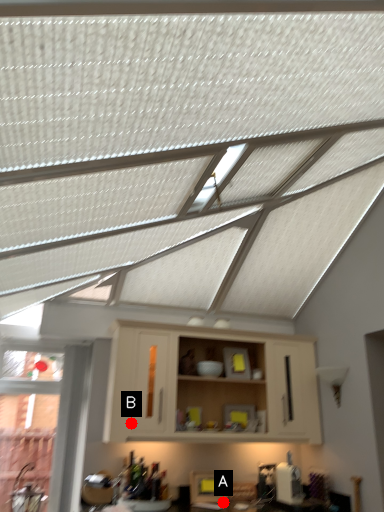
Question: Two points are circled on the image, labeled by A and B beside each circle. Which of the following is the farthest from the observer?

Choices:
 (A) A is further
 (B) B is further

Answer: (A)